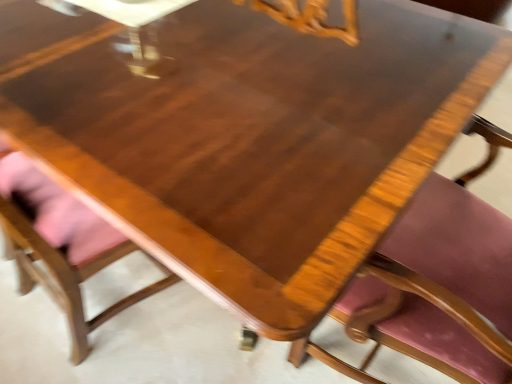
Where is `wooden chair with pink cushion at center, which is the 1th chair from right to left`? Image resolution: width=512 pixels, height=384 pixels. wooden chair with pink cushion at center, which is the 1th chair from right to left is located at coordinates (441, 280).

What do you see at coordinates (441, 280) in the screenshot? This screenshot has width=512, height=384. I see `wooden chair with pink cushion at center, which is the 1th chair from right to left` at bounding box center [441, 280].

The height and width of the screenshot is (384, 512). Find the location of `wooden chair with pink cushion at lower left, which ranks as the 1th chair in left-to-right order`. wooden chair with pink cushion at lower left, which ranks as the 1th chair in left-to-right order is located at coordinates (61, 245).

What is the approximate width of wooden chair with pink cushion at lower left, which ranks as the 1th chair in left-to-right order?

wooden chair with pink cushion at lower left, which ranks as the 1th chair in left-to-right order, is 16.28 inches wide.

What do you see at coordinates (61, 245) in the screenshot?
I see `wooden chair with pink cushion at lower left, marked as the 2th chair in a right-to-left arrangement` at bounding box center [61, 245].

This screenshot has width=512, height=384. Identify the location of wooden chair with pink cushion at center, which is the 1th chair from right to left. (441, 280).

Is wooden chair with pink cushion at lower left, marked as the 2th chair in a right-to-left arrangement, to the left or to the right of wooden chair with pink cushion at center, which is the 1th chair from right to left, in the image?

wooden chair with pink cushion at lower left, marked as the 2th chair in a right-to-left arrangement, is to the left of wooden chair with pink cushion at center, which is the 1th chair from right to left.

Considering their positions, is wooden chair with pink cushion at lower left, which ranks as the 1th chair in left-to-right order, located in front of or behind wooden chair with pink cushion at center, which is the 1th chair from right to left?

wooden chair with pink cushion at lower left, which ranks as the 1th chair in left-to-right order, is positioned farther from the viewer than wooden chair with pink cushion at center, which is the 1th chair from right to left.

Is point (128, 300) closer to camera compared to point (470, 376)?

No.

From the image's perspective, is wooden chair with pink cushion at lower left, which ranks as the 1th chair in left-to-right order, positioned above or below wooden chair with pink cushion at center, which is the 1th chair from right to left?

Clearly, from the image's perspective, wooden chair with pink cushion at lower left, which ranks as the 1th chair in left-to-right order, is above wooden chair with pink cushion at center, which is the 1th chair from right to left.

From a real-world perspective, is wooden chair with pink cushion at lower left, which ranks as the 1th chair in left-to-right order, on wooden chair with pink cushion at center, which ranks as the second chair in left-to-right order?

Actually, wooden chair with pink cushion at lower left, which ranks as the 1th chair in left-to-right order, is physically below wooden chair with pink cushion at center, which ranks as the second chair in left-to-right order, in the real world.

Considering the relative sizes of wooden chair with pink cushion at lower left, marked as the 2th chair in a right-to-left arrangement, and wooden chair with pink cushion at center, which is the 1th chair from right to left, in the image provided, is wooden chair with pink cushion at lower left, marked as the 2th chair in a right-to-left arrangement, thinner than wooden chair with pink cushion at center, which is the 1th chair from right to left,?

Yes, wooden chair with pink cushion at lower left, marked as the 2th chair in a right-to-left arrangement, is thinner than wooden chair with pink cushion at center, which is the 1th chair from right to left.

Who is shorter, wooden chair with pink cushion at lower left, marked as the 2th chair in a right-to-left arrangement, or wooden chair with pink cushion at center, which ranks as the second chair in left-to-right order?

wooden chair with pink cushion at lower left, marked as the 2th chair in a right-to-left arrangement.

Considering the sizes of objects wooden chair with pink cushion at lower left, which ranks as the 1th chair in left-to-right order, and wooden chair with pink cushion at center, which is the 1th chair from right to left, in the image provided, who is bigger, wooden chair with pink cushion at lower left, which ranks as the 1th chair in left-to-right order, or wooden chair with pink cushion at center, which is the 1th chair from right to left,?

Bigger between the two is wooden chair with pink cushion at center, which is the 1th chair from right to left.

Would you say wooden chair with pink cushion at center, which is the 1th chair from right to left, is part of wooden chair with pink cushion at lower left, marked as the 2th chair in a right-to-left arrangement,'s contents?

Actually, wooden chair with pink cushion at center, which is the 1th chair from right to left, is outside wooden chair with pink cushion at lower left, marked as the 2th chair in a right-to-left arrangement.

In the scene shown: Are wooden chair with pink cushion at lower left, marked as the 2th chair in a right-to-left arrangement, and wooden chair with pink cushion at center, which ranks as the second chair in left-to-right order, far apart?

Actually, wooden chair with pink cushion at lower left, marked as the 2th chair in a right-to-left arrangement, and wooden chair with pink cushion at center, which ranks as the second chair in left-to-right order, are a little close together.

Is wooden chair with pink cushion at center, which ranks as the second chair in left-to-right order, at the back of wooden chair with pink cushion at lower left, which ranks as the 1th chair in left-to-right order?

No, wooden chair with pink cushion at lower left, which ranks as the 1th chair in left-to-right order, is not facing away from wooden chair with pink cushion at center, which ranks as the second chair in left-to-right order.

At what (x,y) coordinates should I click in order to perform the action: click on chair on the right of wooden chair with pink cushion at lower left, which ranks as the 1th chair in left-to-right order. Please return your answer as a coordinate pair (x, y). The image size is (512, 384). Looking at the image, I should click on (441, 280).

Considering the relative positions of wooden chair with pink cushion at center, which is the 1th chair from right to left, and wooden chair with pink cushion at lower left, which ranks as the 1th chair in left-to-right order, in the image provided, is wooden chair with pink cushion at center, which is the 1th chair from right to left, to the left or to the right of wooden chair with pink cushion at lower left, which ranks as the 1th chair in left-to-right order,?

Clearly, wooden chair with pink cushion at center, which is the 1th chair from right to left, is on the right of wooden chair with pink cushion at lower left, which ranks as the 1th chair in left-to-right order, in the image.

Which object is more forward, wooden chair with pink cushion at center, which is the 1th chair from right to left, or wooden chair with pink cushion at lower left, marked as the 2th chair in a right-to-left arrangement?

wooden chair with pink cushion at center, which is the 1th chair from right to left.

Which is closer to the camera, (386, 326) or (14, 153)?

The point (386, 326) is closer.

From the image's perspective, is wooden chair with pink cushion at center, which is the 1th chair from right to left, over wooden chair with pink cushion at lower left, marked as the 2th chair in a right-to-left arrangement?

No, from the image's perspective, wooden chair with pink cushion at center, which is the 1th chair from right to left, is not over wooden chair with pink cushion at lower left, marked as the 2th chair in a right-to-left arrangement.

From a real-world perspective, does wooden chair with pink cushion at center, which ranks as the second chair in left-to-right order, stand above wooden chair with pink cushion at lower left, which ranks as the 1th chair in left-to-right order?

Yes, from a real-world perspective, wooden chair with pink cushion at center, which ranks as the second chair in left-to-right order, is on top of wooden chair with pink cushion at lower left, which ranks as the 1th chair in left-to-right order.

Which of these two, wooden chair with pink cushion at center, which is the 1th chair from right to left, or wooden chair with pink cushion at lower left, which ranks as the 1th chair in left-to-right order, is wider?

wooden chair with pink cushion at center, which is the 1th chair from right to left, is wider.

Who is taller, wooden chair with pink cushion at center, which ranks as the second chair in left-to-right order, or wooden chair with pink cushion at lower left, which ranks as the 1th chair in left-to-right order?

wooden chair with pink cushion at center, which ranks as the second chair in left-to-right order, is taller.

Can you confirm if wooden chair with pink cushion at center, which ranks as the second chair in left-to-right order, is smaller than wooden chair with pink cushion at lower left, marked as the 2th chair in a right-to-left arrangement?

Incorrect, wooden chair with pink cushion at center, which ranks as the second chair in left-to-right order, is not smaller in size than wooden chair with pink cushion at lower left, marked as the 2th chair in a right-to-left arrangement.

Would you say wooden chair with pink cushion at center, which is the 1th chair from right to left, contains wooden chair with pink cushion at lower left, which ranks as the 1th chair in left-to-right order?

No, wooden chair with pink cushion at lower left, which ranks as the 1th chair in left-to-right order, is not a part of wooden chair with pink cushion at center, which is the 1th chair from right to left.

Is wooden chair with pink cushion at center, which is the 1th chair from right to left, next to wooden chair with pink cushion at lower left, marked as the 2th chair in a right-to-left arrangement?

No.

Is wooden chair with pink cushion at center, which ranks as the second chair in left-to-right order, positioned with its back to wooden chair with pink cushion at lower left, which ranks as the 1th chair in left-to-right order?

No, wooden chair with pink cushion at center, which ranks as the second chair in left-to-right order, is not facing away from wooden chair with pink cushion at lower left, which ranks as the 1th chair in left-to-right order.

This screenshot has height=384, width=512. What are the coordinates of `chair above the wooden chair with pink cushion at lower left, marked as the 2th chair in a right-to-left arrangement (from a real-world perspective)` in the screenshot? It's located at (441, 280).

Locate an element on the screen. The width and height of the screenshot is (512, 384). chair below the wooden chair with pink cushion at lower left, which ranks as the 1th chair in left-to-right order (from the image's perspective) is located at coordinates (441, 280).

Locate an element on the screen. This screenshot has width=512, height=384. chair located in front of the wooden chair with pink cushion at lower left, marked as the 2th chair in a right-to-left arrangement is located at coordinates (441, 280).